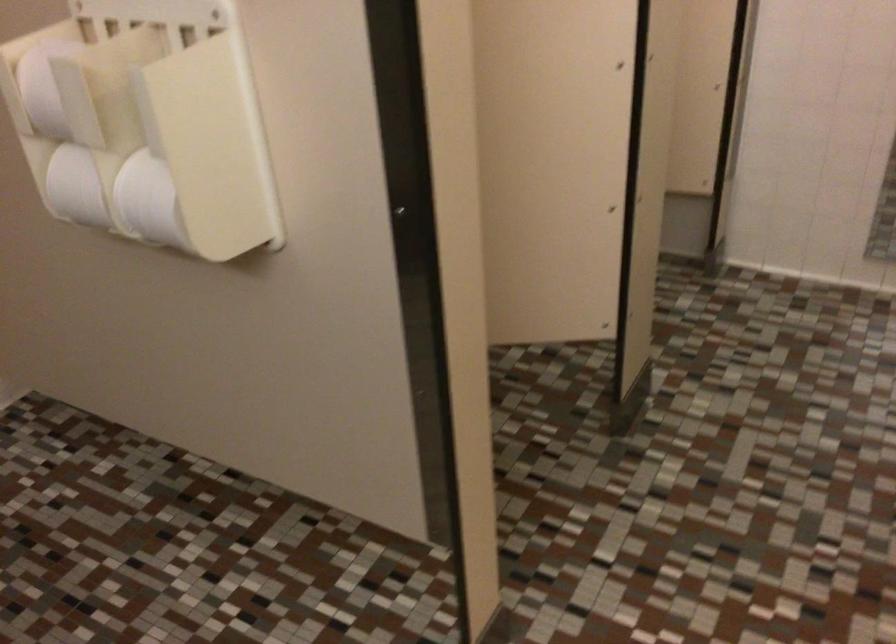
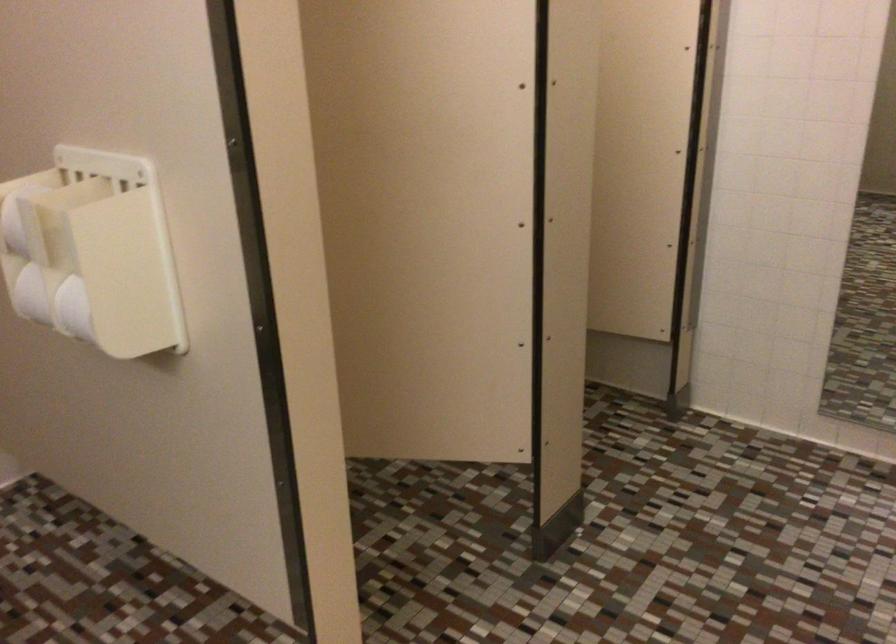
In the second image, find the point that corresponds to point (113, 191) in the first image.

(53, 303)